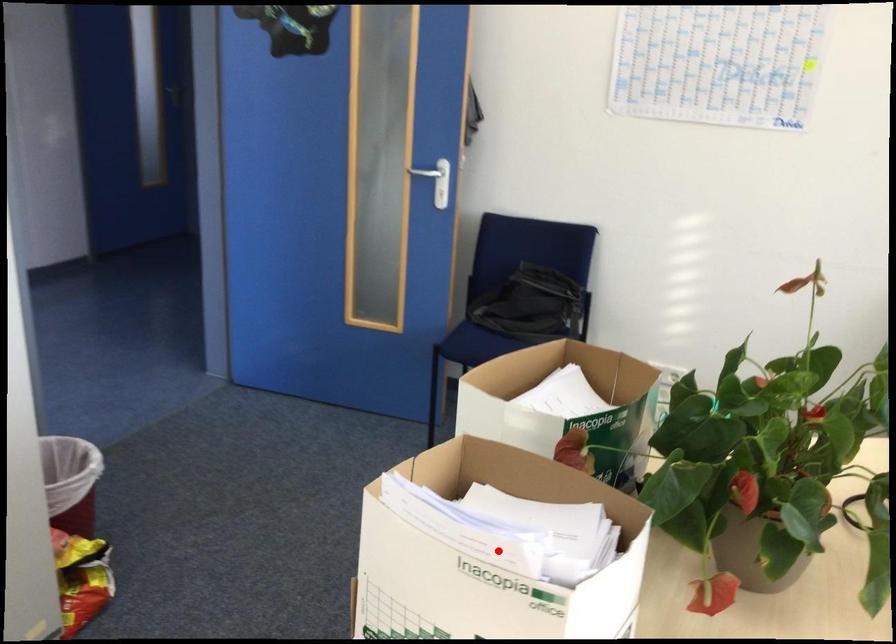
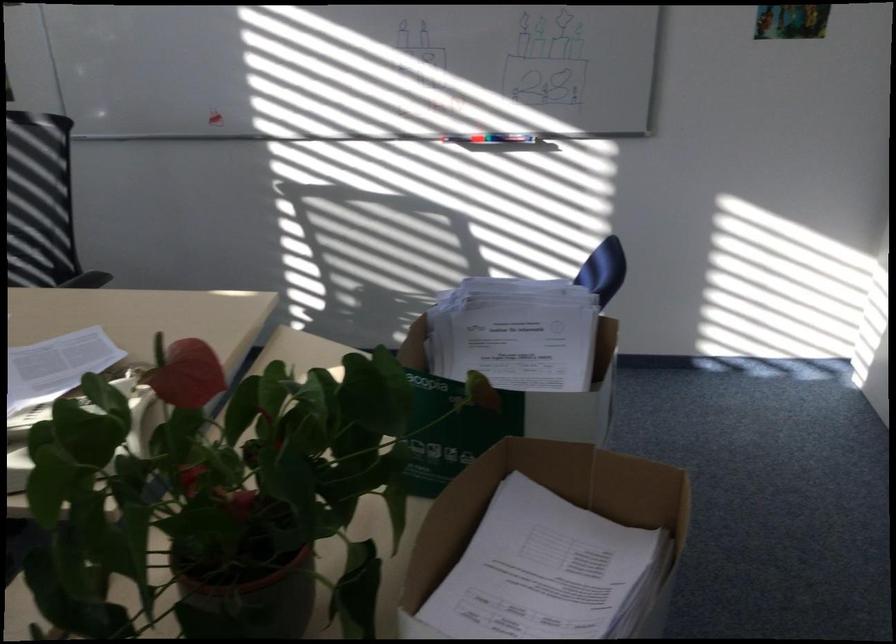
Where in the second image is the point corresponding to the highlighted location from the first image?

(451, 431)